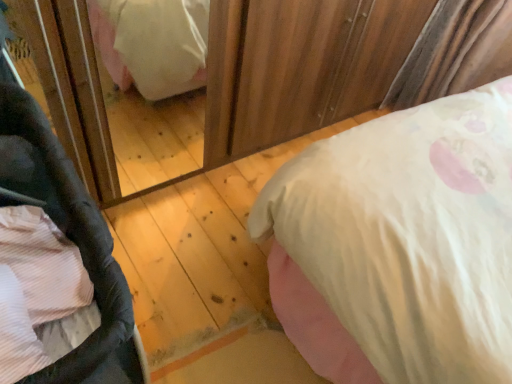
Question: Is black fabric baby carriage at lower left wider or thinner than pink satin bed at lower left?

Choices:
 (A) thin
 (B) wide

Answer: (A)

Question: Relative to pink satin bed at lower left, is black fabric baby carriage at lower left in front or behind?

Choices:
 (A) front
 (B) behind

Answer: (A)

Question: Considering the positions of black fabric baby carriage at lower left and pink satin bed at lower left in the image, is black fabric baby carriage at lower left taller or shorter than pink satin bed at lower left?

Choices:
 (A) short
 (B) tall

Answer: (B)

Question: Is point (316, 175) positioned closer to the camera than point (136, 332)?

Choices:
 (A) closer
 (B) farther

Answer: (A)

Question: Is pink satin bed at lower left inside or outside of black fabric baby carriage at lower left?

Choices:
 (A) inside
 (B) outside

Answer: (B)

Question: Looking at the image, does pink satin bed at lower left seem bigger or smaller compared to black fabric baby carriage at lower left?

Choices:
 (A) big
 (B) small

Answer: (B)

Question: Would you say pink satin bed at lower left is to the left or to the right of black fabric baby carriage at lower left in the picture?

Choices:
 (A) left
 (B) right

Answer: (B)